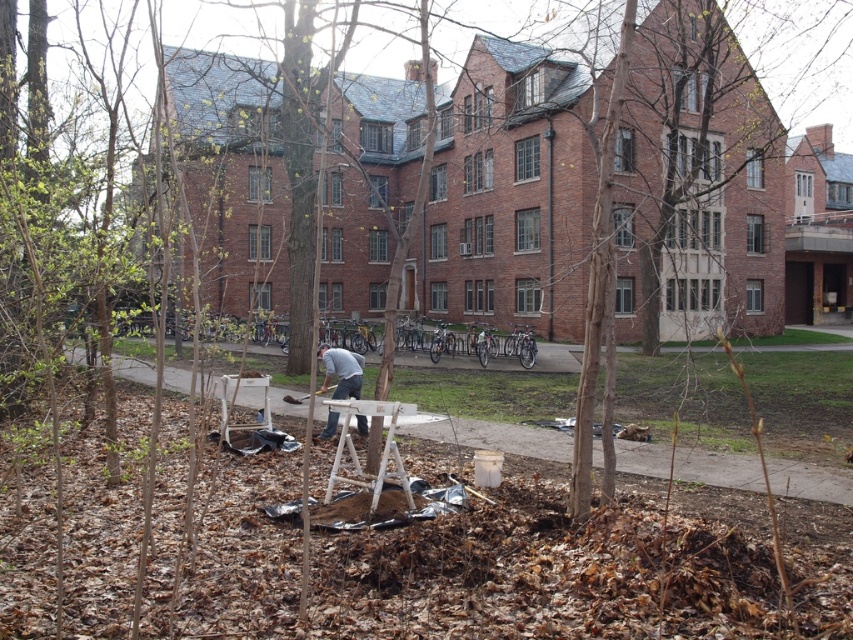
Between white wood easel at center and gray fabric at center, which one has more height?

Standing taller between the two is white wood easel at center.

Which is more to the left, white wood easel at center or gray fabric at center?

gray fabric at center

Find the location of a particular element. white wood easel at center is located at coordinates (381, 452).